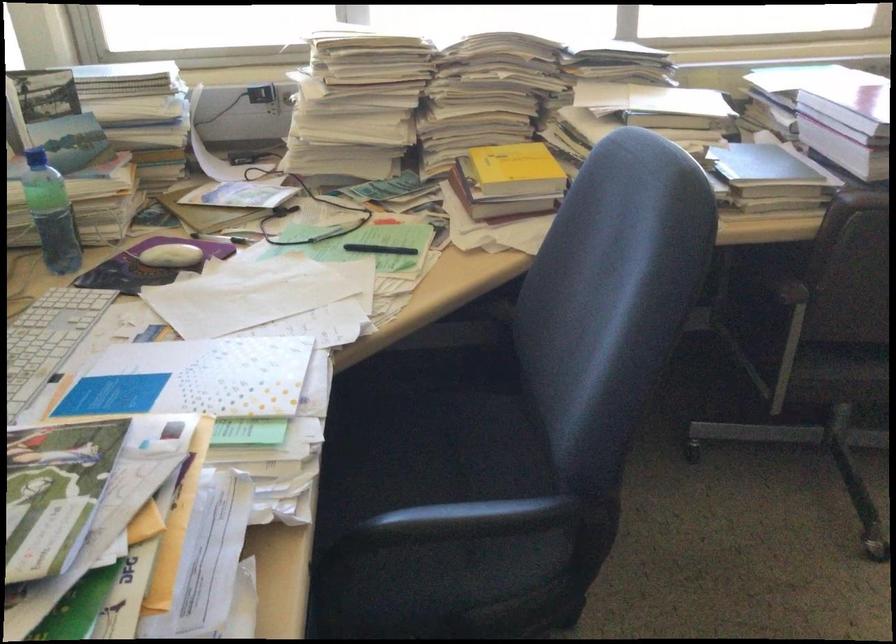
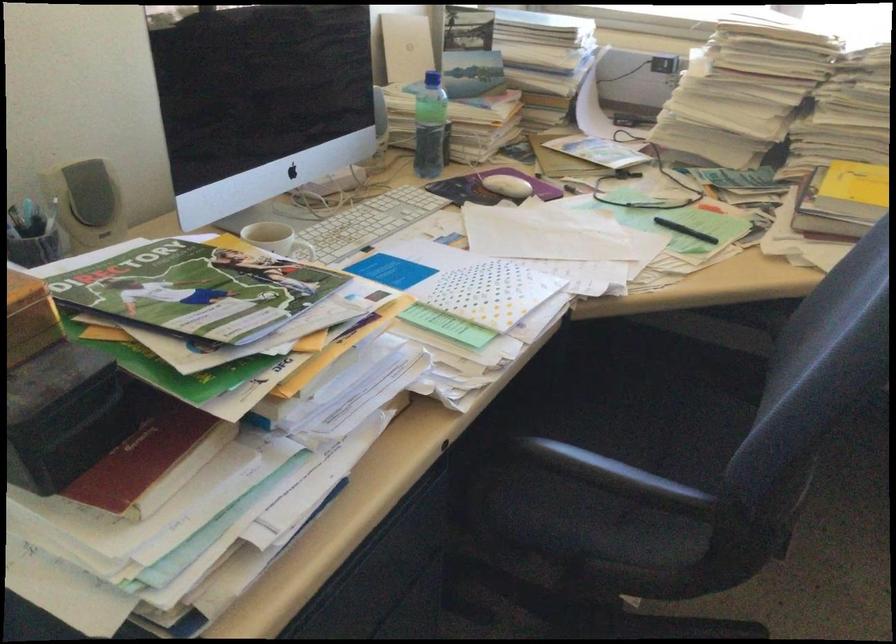
Locate, in the second image, the point that corresponds to point 176,258 in the first image.

(506, 185)